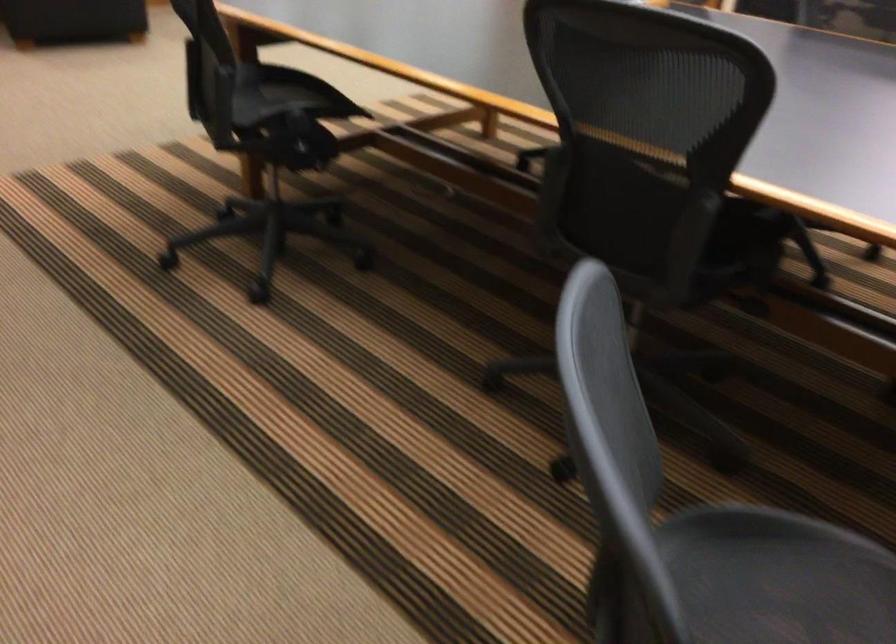
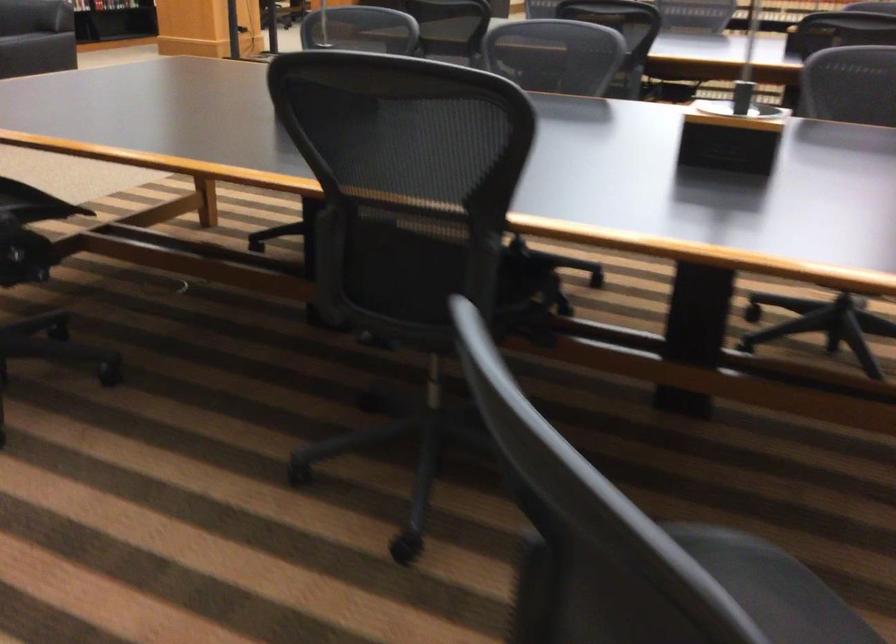
What movement of the cameraman would produce the second image?

The cameraman walked toward left, forward.